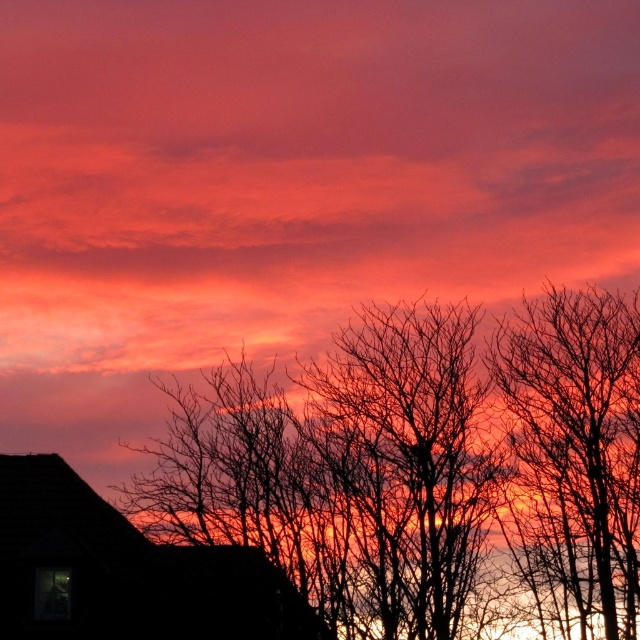
The image size is (640, 640). Identify the location of silhouette bare tree at center. (426, 468).

Who is positioned more to the left, silhouette bare tree at center or bare branches at right?

From the viewer's perspective, silhouette bare tree at center appears more on the left side.

Is point (195, 474) farther from viewer compared to point (506, 326)?

No, it is in front of (506, 326).

Locate an element on the screen. The image size is (640, 640). silhouette bare tree at center is located at coordinates (426, 468).